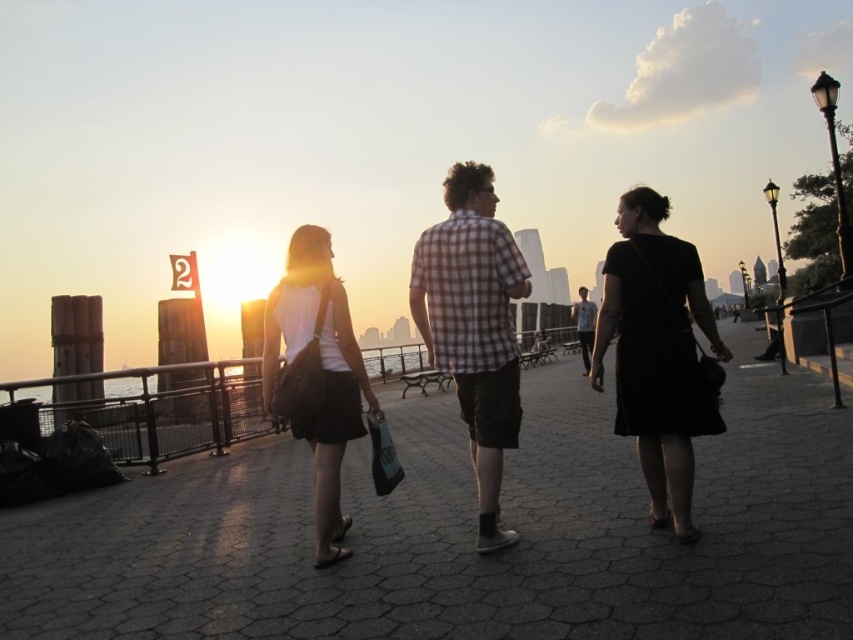
You are standing on the waterfront promenade and want to take a photo of two specific points in the scene. The first point is at coordinates point (498, 356) and the second point is at point (611, 298). Which of these two points is closer to you?

Point (498, 356) is closer to the viewer than point (611, 298).

You are a photographer trying to capture the group of three people walking away from you. You notice the matte plaid shirt at center and the matte black bag at center. Which object is located to the right of the other?

The matte plaid shirt at center is positioned on the right side of matte black bag at center.